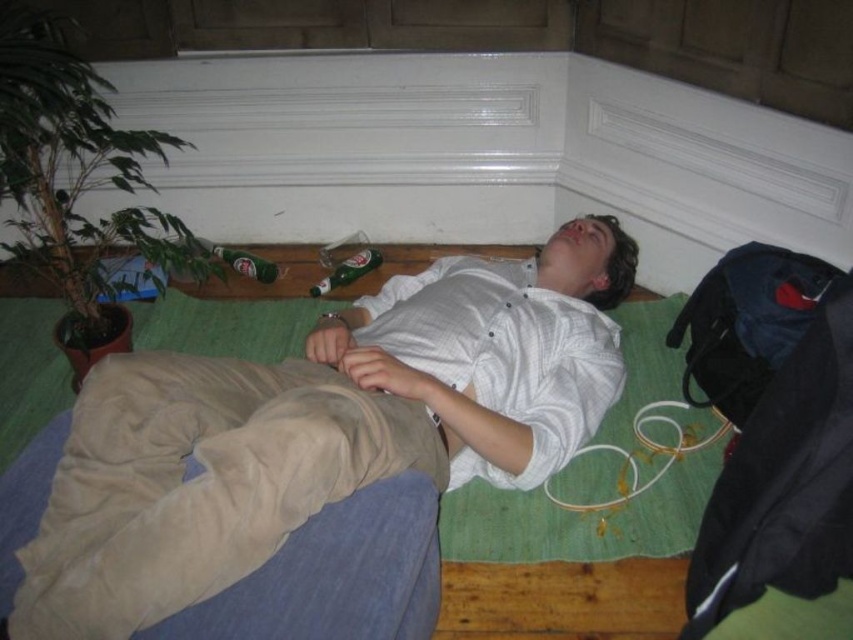
Question: Is green glass bottle at lower center further to camera compared to green glass bottle at center?

Choices:
 (A) no
 (B) yes

Answer: (A)

Question: Which of the following is the closest to the observer?

Choices:
 (A) white cotton shirt at center
 (B) green glass bottle at lower center
 (C) green glass bottle at center

Answer: (A)

Question: Which object is closer to the camera taking this photo?

Choices:
 (A) green glass bottle at lower center
 (B) white cotton shirt at center
 (C) green glass bottle at center

Answer: (B)

Question: Does white cotton shirt at center appear on the left side of green glass bottle at center?

Choices:
 (A) yes
 (B) no

Answer: (B)

Question: Where is white cotton shirt at center located in relation to green glass bottle at center in the image?

Choices:
 (A) left
 (B) right

Answer: (B)

Question: Which point is closer to the camera?

Choices:
 (A) green glass bottle at center
 (B) white cotton shirt at center

Answer: (B)